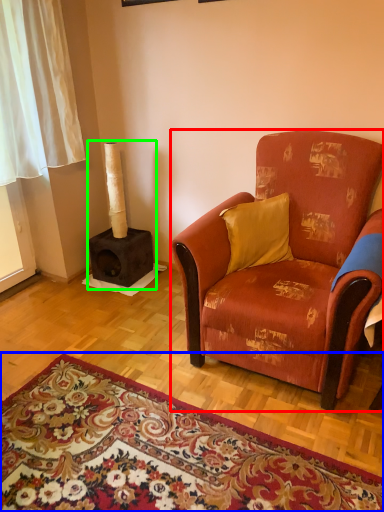
Question: Which object is the farthest from studio couch (highlighted by a red box)? Choose among these: mat (highlighted by a blue box) or fireplace (highlighted by a green box).

Choices:
 (A) mat
 (B) fireplace

Answer: (B)